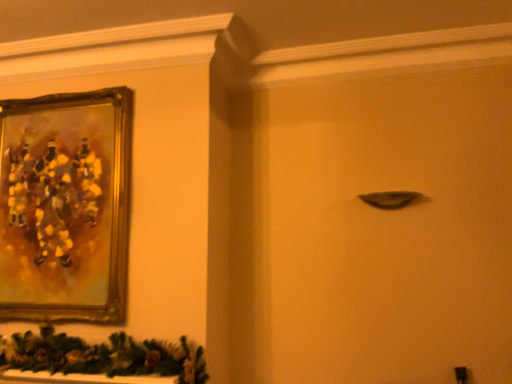
The width and height of the screenshot is (512, 384). What do you see at coordinates (65, 206) in the screenshot?
I see `gold-framed painting at upper left` at bounding box center [65, 206].

The image size is (512, 384). Identify the location of gold-framed painting at upper left. pyautogui.click(x=65, y=206).

Where is `gold-framed painting at upper left`? The height and width of the screenshot is (384, 512). gold-framed painting at upper left is located at coordinates (65, 206).